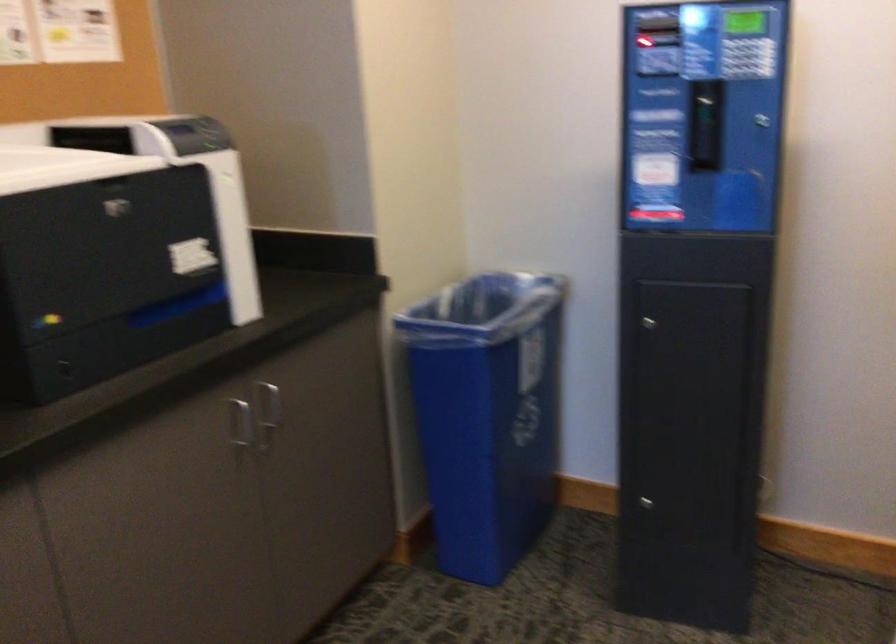
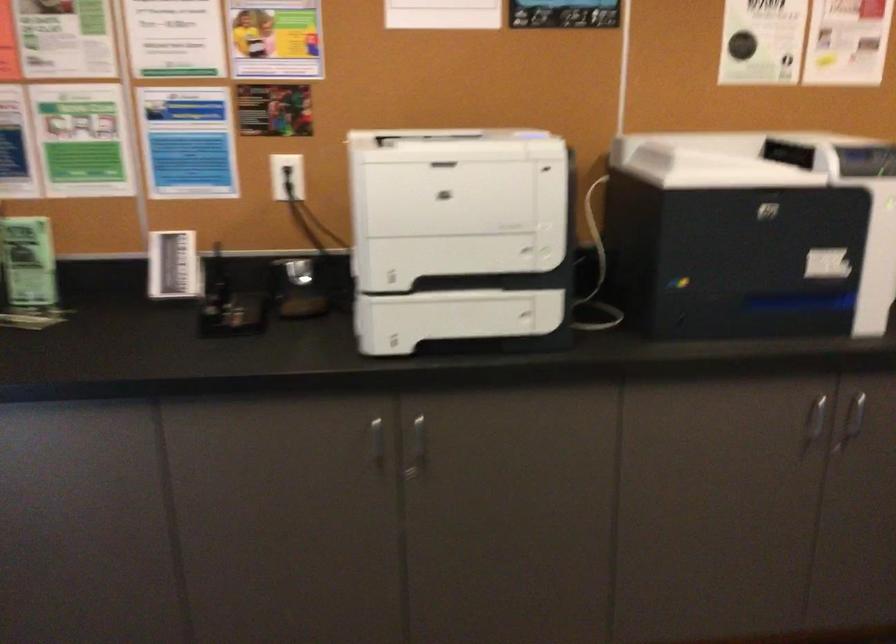
Question: Based on the continuous images, in which direction is the camera rotating? Reply with the corresponding letter.

Choices:
 (A) Left
 (B) Right
 (C) Up
 (D) Down

Answer: (A)